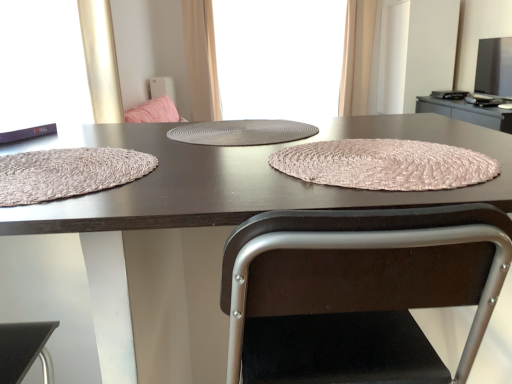
Question: Is gray textured placemat at center surrounding beige fabric curtain at upper right, the first curtain when ordered from right to left?

Choices:
 (A) yes
 (B) no

Answer: (B)

Question: Does gray textured placemat at center have a larger size compared to beige fabric curtain at upper right, the first curtain when ordered from right to left?

Choices:
 (A) no
 (B) yes

Answer: (A)

Question: Is gray textured placemat at center far away from beige fabric curtain at upper right, the first curtain when ordered from right to left?

Choices:
 (A) no
 (B) yes

Answer: (B)

Question: Is gray textured placemat at center further to camera compared to beige fabric curtain at upper right, which is the 2th curtain from left to right?

Choices:
 (A) no
 (B) yes

Answer: (A)

Question: Is gray textured placemat at center at the left side of beige fabric curtain at upper right, the first curtain when ordered from right to left?

Choices:
 (A) yes
 (B) no

Answer: (A)

Question: From the image's perspective, is pink woven placemat at center, which appears as the second blanket when viewed from the left, above or below matte brown placemat at center?

Choices:
 (A) below
 (B) above

Answer: (B)

Question: Is pink woven placemat at center, the 1th blanket from the right, bigger or smaller than matte brown placemat at center?

Choices:
 (A) big
 (B) small

Answer: (B)

Question: Is point (437, 148) closer or farther from the camera than point (173, 365)?

Choices:
 (A) farther
 (B) closer

Answer: (B)

Question: Is pink woven placemat at center, the 1th blanket from the right, inside the boundaries of matte brown placemat at center, or outside?

Choices:
 (A) outside
 (B) inside

Answer: (B)

Question: Would you say gray textured placemat at center is to the left or to the right of gray woven placemat at center, placed as the 1th window screen when sorted from top to bottom, in the picture?

Choices:
 (A) right
 (B) left

Answer: (B)

Question: From the image's perspective, is gray textured placemat at center above or below gray woven placemat at center, the second window screen when ordered from bottom to top?

Choices:
 (A) above
 (B) below

Answer: (B)

Question: From their relative heights in the image, would you say gray textured placemat at center is taller or shorter than gray woven placemat at center, placed as the 1th window screen when sorted from top to bottom?

Choices:
 (A) tall
 (B) short

Answer: (B)

Question: In terms of width, does gray textured placemat at center look wider or thinner when compared to gray woven placemat at center, the 2th window screen in the left-to-right sequence?

Choices:
 (A) wide
 (B) thin

Answer: (A)

Question: Based on their positions, is matte brown placemat at center located to the left or right of beige fabric curtain at upper right, which is the 2th curtain from left to right?

Choices:
 (A) right
 (B) left

Answer: (B)

Question: Is matte brown placemat at center inside or outside of beige fabric curtain at upper right, the first curtain when ordered from right to left?

Choices:
 (A) outside
 (B) inside

Answer: (A)